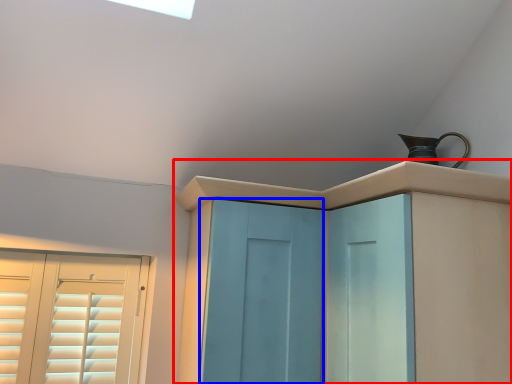
Question: Which object appears farthest to the camera in this image, cupboard (highlighted by a red box) or screen door (highlighted by a blue box)?

Choices:
 (A) cupboard
 (B) screen door

Answer: (B)